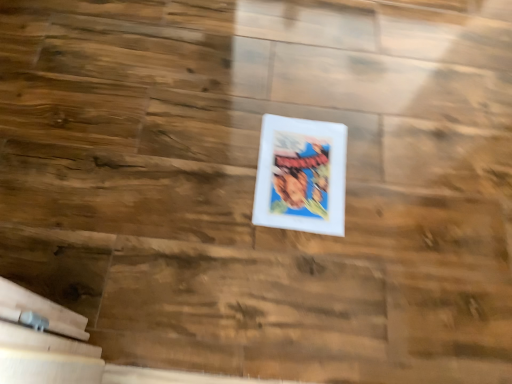
Identify the location of vacant space situated on the left part of white matte picture frame at center. The height and width of the screenshot is (384, 512). (207, 155).